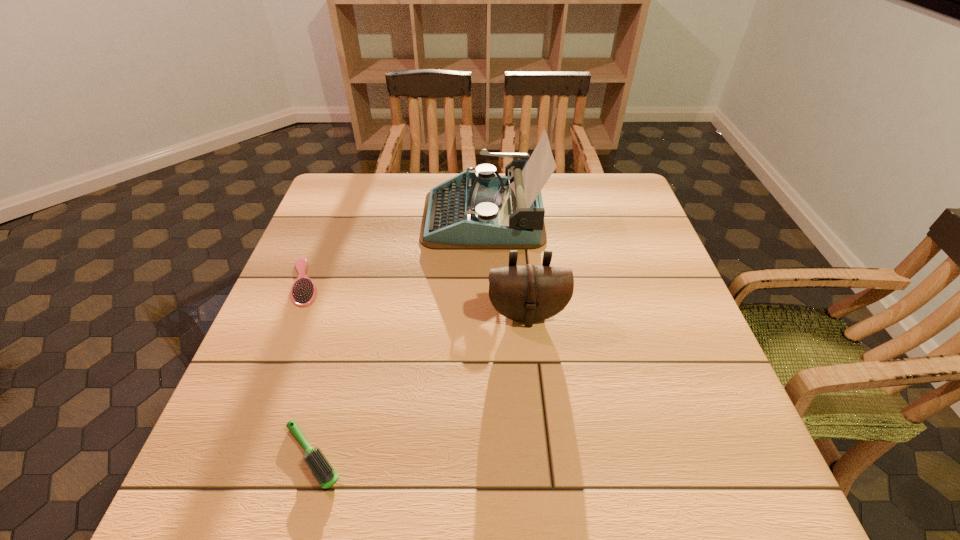
The width and height of the screenshot is (960, 540). In the image, there is a desktop. Find the location of `vacant space at the far right corner`. vacant space at the far right corner is located at coordinates [x=631, y=204].

What are the coordinates of `vacant space that's between the typewriter and the second tallest object` in the screenshot? It's located at (505, 265).

Locate an element on the screen. The height and width of the screenshot is (540, 960). empty space between the third shortest object and the farther hairbrush is located at coordinates (416, 298).

Locate an element on the screen. Image resolution: width=960 pixels, height=540 pixels. unoccupied position between the farther hairbrush and the right hairbrush is located at coordinates (308, 368).

In order to click on vacant space in between the nearest object and the typewriter in this screenshot , I will do `click(397, 336)`.

Identify the location of blank region between the shorter hairbrush and the farthest object. The width and height of the screenshot is (960, 540). (394, 249).

Find the location of a particular element. This screenshot has height=540, width=960. empty space between the second tallest object and the shorter hairbrush is located at coordinates (416, 298).

Identify the location of empty space between the shorter hairbrush and the taller hairbrush. The height and width of the screenshot is (540, 960). (308, 368).

Find the location of a particular element. This screenshot has width=960, height=540. vacant area that lies between the farthest object and the nearer hairbrush is located at coordinates (397, 336).

You are a GUI agent. You are given a task and a screenshot of the screen. Output one action in this format:
    pyautogui.click(x=<x>, y=<y>)
    Task: Click on the unoccupied position between the farther hairbrush and the second tallest object
    This screenshot has height=540, width=960.
    Given the screenshot: What is the action you would take?
    pyautogui.click(x=416, y=298)